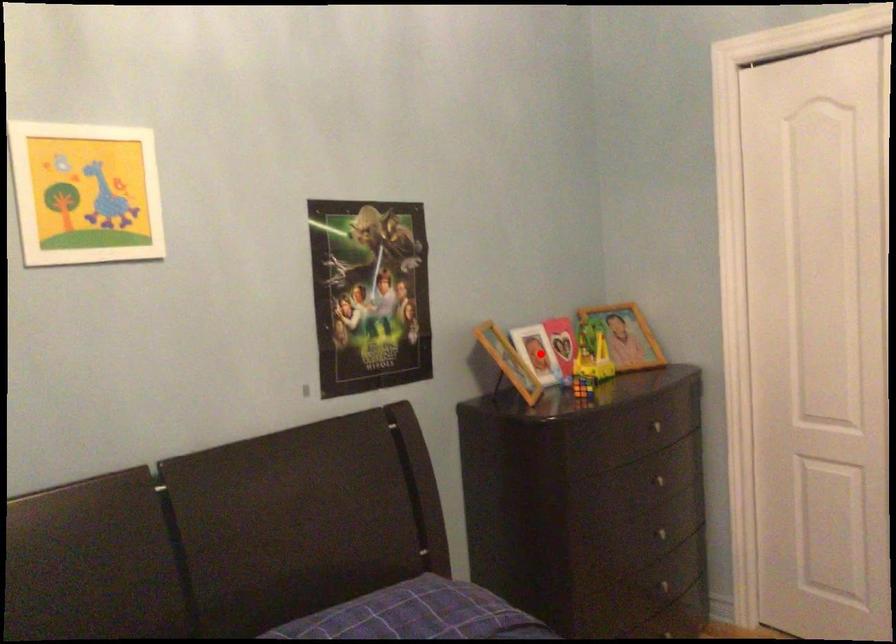
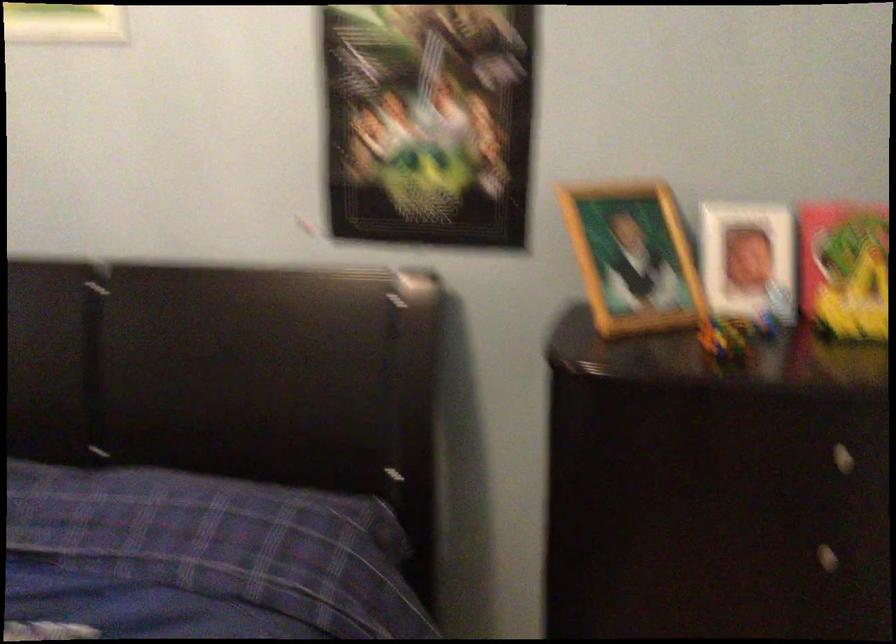
Locate, in the second image, the point that corresponds to the highlighted location in the first image.

(748, 261)